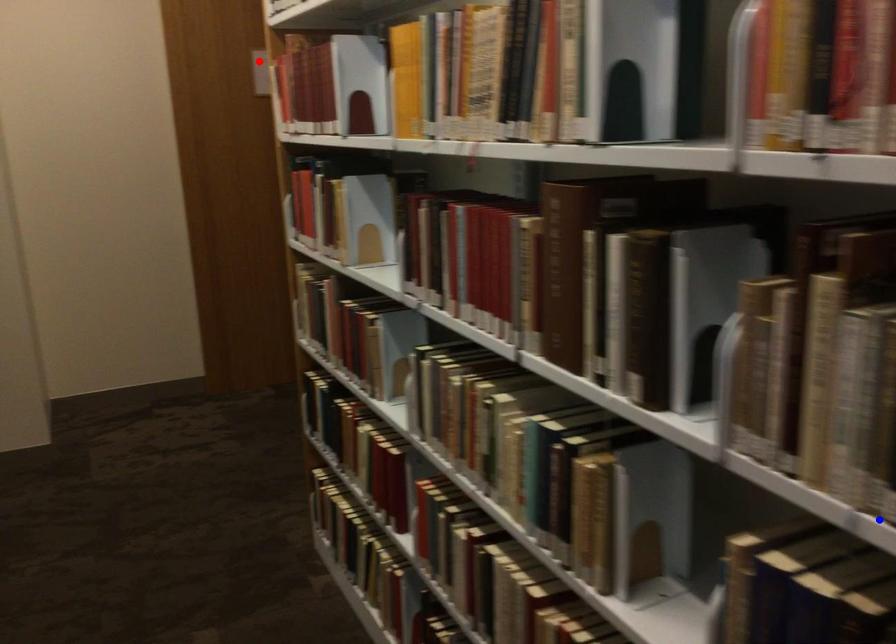
Question: Which of the two points in the image is closer to the camera?

Choices:
 (A) Blue point is closer.
 (B) Red point is closer.

Answer: (A)